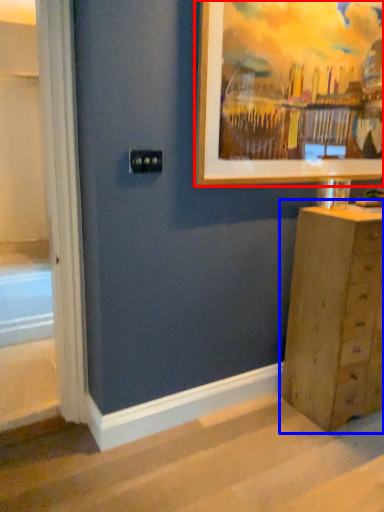
Question: Which object is closer to the camera taking this photo, picture frame (highlighted by a red box) or chest of drawers (highlighted by a blue box)?

Choices:
 (A) picture frame
 (B) chest of drawers

Answer: (A)